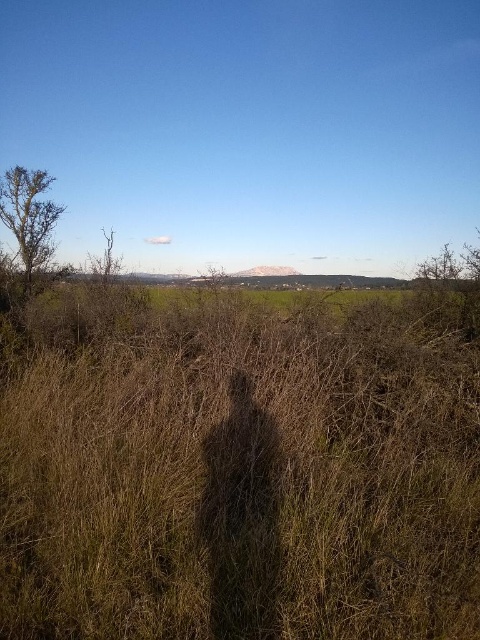
Question: Is brown dry grass at center below bare branches at left?

Choices:
 (A) yes
 (B) no

Answer: (A)

Question: Is brown dry grass at center below bare branches at left?

Choices:
 (A) no
 (B) yes

Answer: (B)

Question: Is brown dry grass at center smaller than bare branches at left?

Choices:
 (A) no
 (B) yes

Answer: (A)

Question: Which point is farther to the camera?

Choices:
 (A) brown dry grass at center
 (B) bare branches at left

Answer: (B)

Question: Which of the following is the farthest from the observer?

Choices:
 (A) brown dry grass at center
 (B) bare branches at left

Answer: (B)